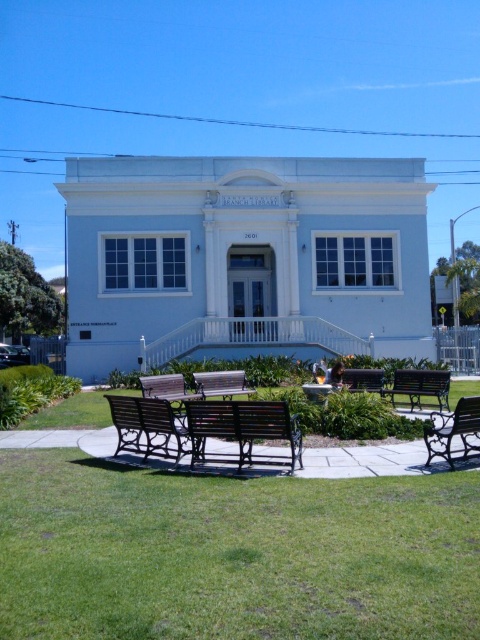
Question: Can you confirm if metallic polished bench at center is positioned above brown wooden bench at center?

Choices:
 (A) no
 (B) yes

Answer: (A)

Question: Which point is farther from the camera taking this photo?

Choices:
 (A) (369, 376)
 (B) (176, 387)
 (C) (57, 464)

Answer: (A)

Question: Estimate the real-world distances between objects in this image. Which object is farther from the black wrought iron bench at lower right?

Choices:
 (A) green grass at lower center
 (B) green wooden bench at lower right
 (C) metallic polished bench at center

Answer: (C)

Question: Based on their relative distances, which object is farther from the metallic polished bench at center?

Choices:
 (A) green grass at lower center
 (B) green wooden bench at lower right
 (C) dark brown wooden bench at center

Answer: (A)

Question: Is black wrought iron bench at lower right further to the viewer compared to metallic polished bench at center?

Choices:
 (A) yes
 (B) no

Answer: (B)

Question: Is black wrought iron bench at lower right to the right of brown wooden bench at center from the viewer's perspective?

Choices:
 (A) yes
 (B) no

Answer: (A)